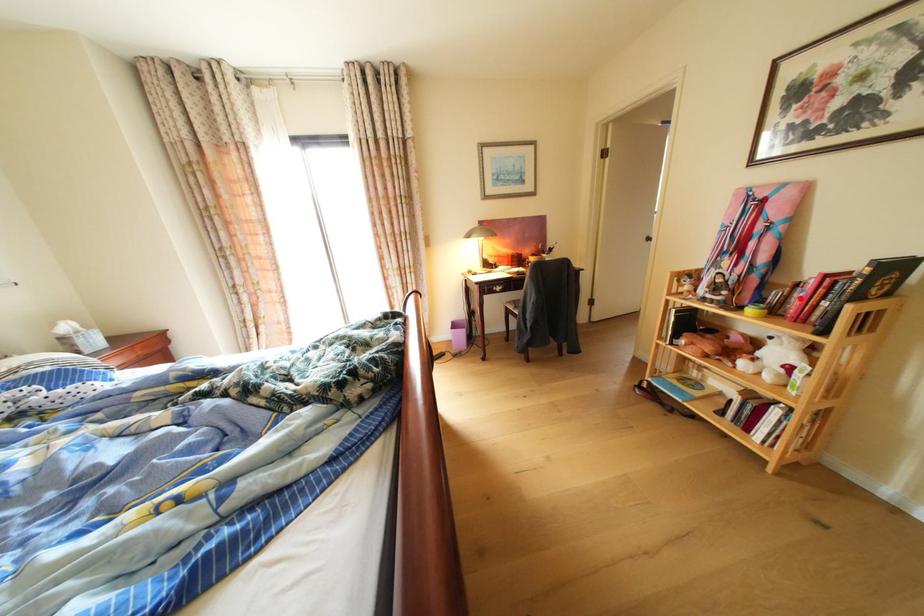
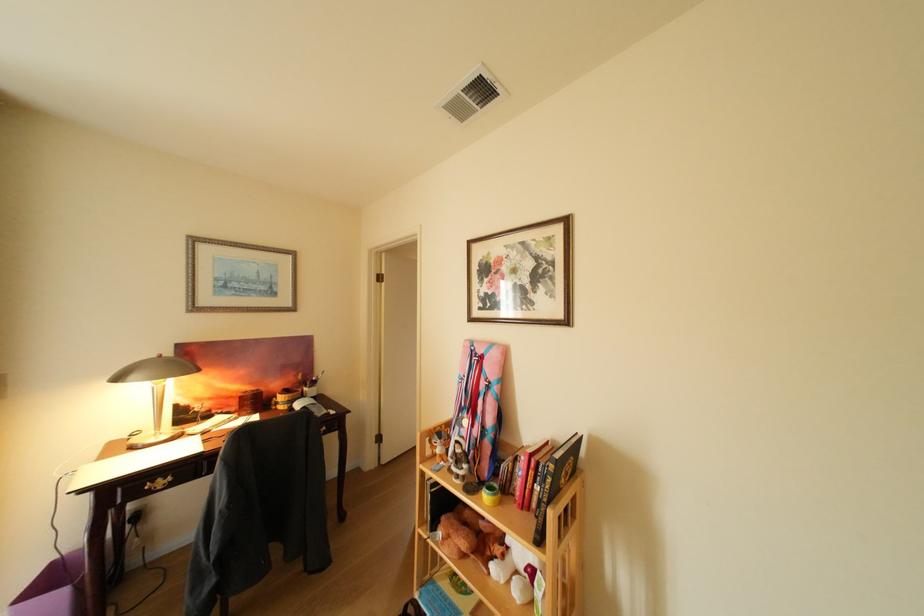
Where in the second image is the point corresponding to the highlighted location from the first image?

(525, 475)